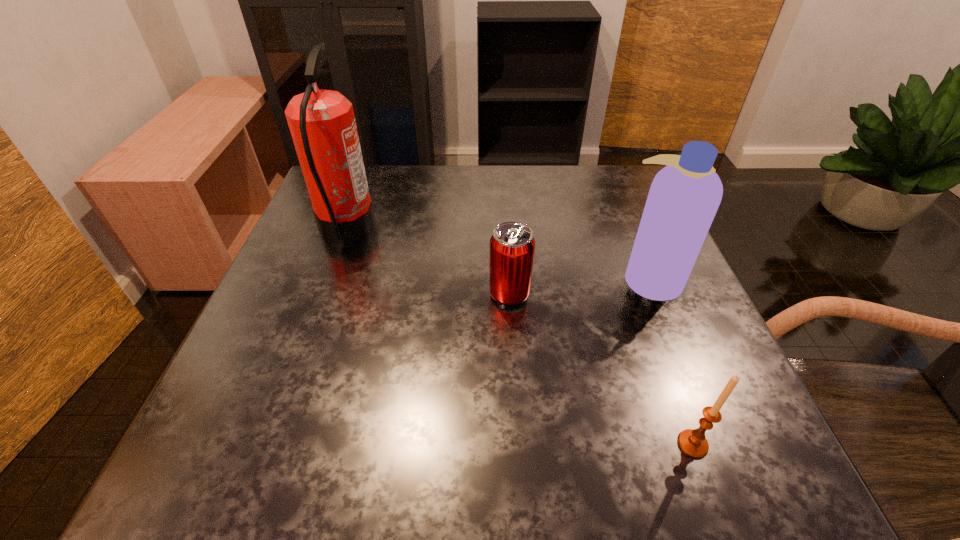
What are the coordinates of `blank area in the image that satisfies the following two spatial constraints: 1. on the back side of the second tallest object; 2. on the right side of the soda can` in the screenshot? It's located at (509, 279).